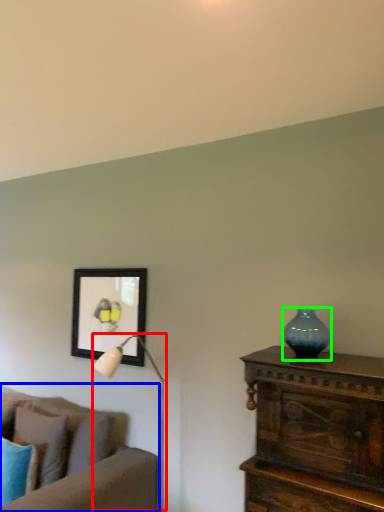
Question: Estimate the real-world distances between objects in this image. Which object is farther from table lamp (highlighted by a red box), studio couch (highlighted by a blue box) or vase (highlighted by a green box)?

Choices:
 (A) studio couch
 (B) vase

Answer: (B)